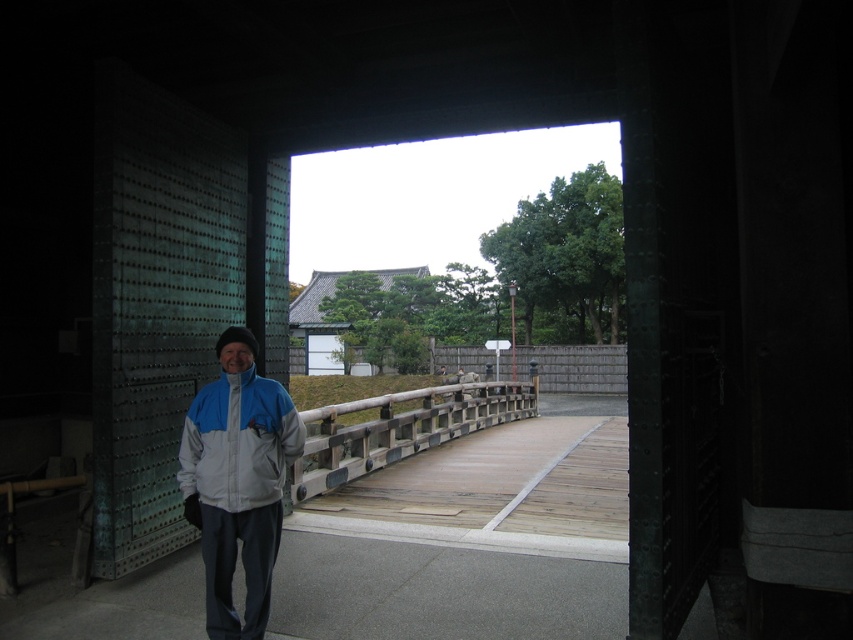
You are a delivery person trying to carry a large package through the gate. The wooden bridge at center and the wooden textured rail at center are in your path. Which object has a narrower width that might make it harder to pass through?

The wooden bridge at center has a lesser width compared to the wooden textured rail at center, so it might be harder to pass through the wooden bridge at center due to its narrower width.

You are a visitor at the entrance of the dark green metal gate. You see the wooden bridge at center and the wooden textured rail at center. Which object is shorter in height?

The wooden bridge at center is not as tall as the wooden textured rail at center, so the wooden bridge at center is shorter in height.